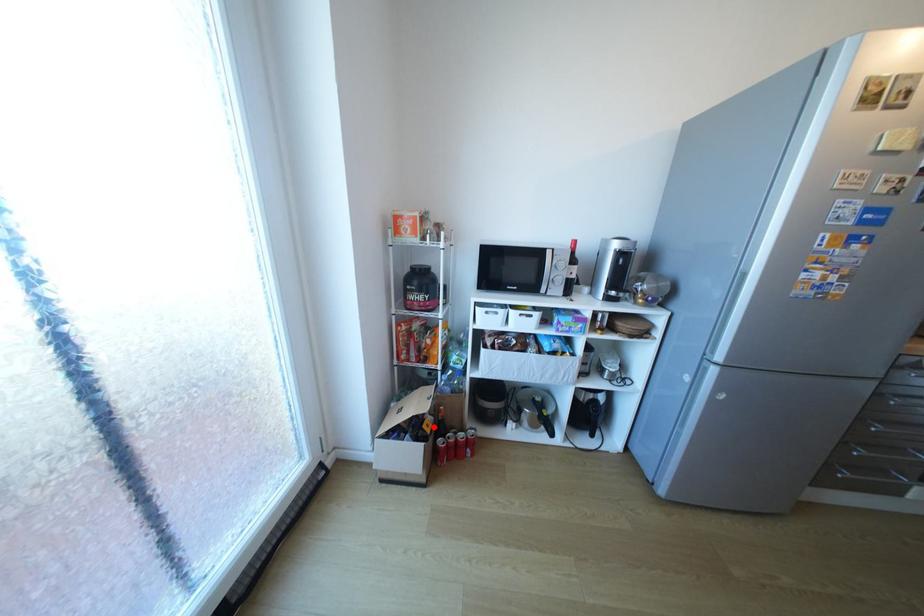
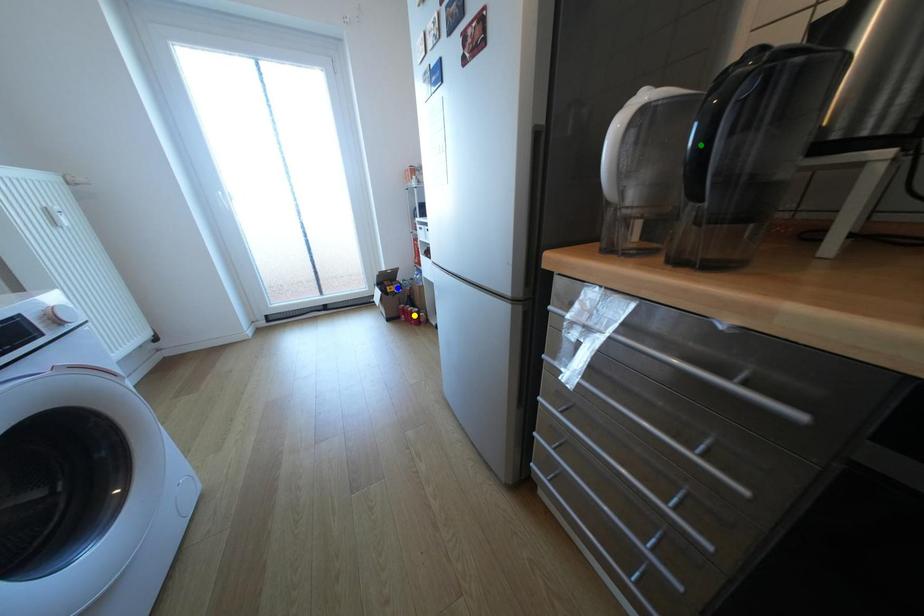
Question: I am providing you with two images of the same scene from different viewpoints. A red point is marked on the first image. You are given multiple points on the second image. Can you choose the point in image 2 that corresponds to the point in image 1?

Choices:
 (A) green point
 (B) blue point
 (C) yellow point

Answer: (B)